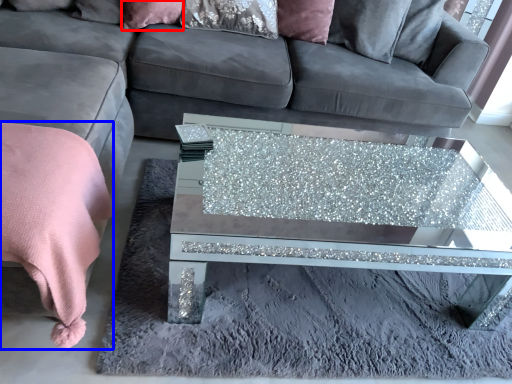
Question: Among these objects, which one is farthest to the camera, pillow (highlighted by a red box) or blanket (highlighted by a blue box)?

Choices:
 (A) pillow
 (B) blanket

Answer: (A)